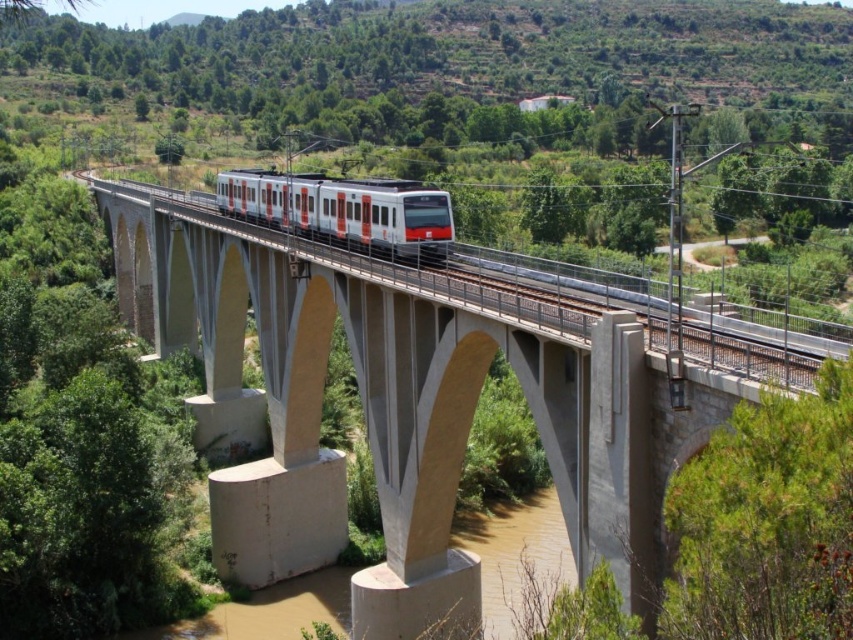
Question: Is white concrete bridge at center to the left of white glossy train at center from the viewer's perspective?

Choices:
 (A) no
 (B) yes

Answer: (B)

Question: Is white concrete bridge at center to the left of white glossy train at center from the viewer's perspective?

Choices:
 (A) yes
 (B) no

Answer: (A)

Question: Does white concrete bridge at center have a larger size compared to white glossy train at center?

Choices:
 (A) yes
 (B) no

Answer: (A)

Question: Which point appears farthest from the camera in this image?

Choices:
 (A) (608, 307)
 (B) (338, 180)

Answer: (B)

Question: Which of the following is the farthest from the observer?

Choices:
 (A) (405, 291)
 (B) (428, 198)

Answer: (B)